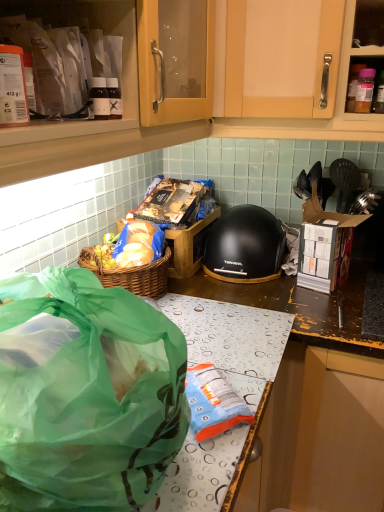
Identify the location of matte plastic container at upper left. The height and width of the screenshot is (512, 384). (123, 49).

I want to click on matte plastic container at upper left, so click(123, 49).

Locate an element on the screen. The image size is (384, 512). helmet located on the right of matte plastic container at upper left is located at coordinates (245, 246).

From a real-world perspective, is matte plastic container at upper left above or below black matte helmet at center?

In terms of real-world spatial position, matte plastic container at upper left is above black matte helmet at center.

Is black matte helmet at center surrounded by matte plastic container at upper left?

No, black matte helmet at center is not surrounded by matte plastic container at upper left.

Which of these two, matte plastic container at upper left or black matte helmet at center, is smaller?

With smaller size is matte plastic container at upper left.

Is black matte helmet at center inside the boundaries of green translucent bag at lower left, or outside?

black matte helmet at center cannot be found inside green translucent bag at lower left.

From the image's perspective, is black matte helmet at center on top of green translucent bag at lower left?

Correct, black matte helmet at center appears higher than green translucent bag at lower left in the image.

Looking at this image, is black matte helmet at center touching green translucent bag at lower left?

No, black matte helmet at center is not in contact with green translucent bag at lower left.

Is matte plastic container at upper left at the back of green translucent bag at lower left?

green translucent bag at lower left is not turned away from matte plastic container at upper left.

This screenshot has height=512, width=384. Find the location of `cabinetry to the left of green translucent bag at lower left`. cabinetry to the left of green translucent bag at lower left is located at coordinates (123, 49).

Considering the sizes of objects green translucent bag at lower left and matte plastic container at upper left in the image provided, who is taller, green translucent bag at lower left or matte plastic container at upper left?

green translucent bag at lower left.

From the image's perspective, is matte plastic container at upper left on green translucent bag at lower left?

Yes.

Is matte plastic container at upper left outside of green translucent bag at lower left?

Yes, matte plastic container at upper left is not within green translucent bag at lower left.

Can you confirm if matte plastic container at upper left is wider than green translucent bag at lower left?

In fact, matte plastic container at upper left might be narrower than green translucent bag at lower left.

Is matte plastic container at upper left oriented away from green translucent bag at lower left?

No.

Considering the sizes of objects green translucent bag at lower left and black matte helmet at center in the image provided, who is taller, green translucent bag at lower left or black matte helmet at center?

Standing taller between the two is green translucent bag at lower left.

Measure the distance between green translucent bag at lower left and black matte helmet at center.

green translucent bag at lower left is 79.77 centimeters from black matte helmet at center.

Is green translucent bag at lower left spatially inside black matte helmet at center, or outside of it?

green translucent bag at lower left lies outside black matte helmet at center.

Does point (96, 280) come in front of point (247, 248)?

That is True.

Would you say black matte helmet at center contains matte plastic container at upper left?

No, matte plastic container at upper left is not inside black matte helmet at center.

Looking at the image, does black matte helmet at center seem bigger or smaller compared to matte plastic container at upper left?

black matte helmet at center is bigger than matte plastic container at upper left.

The height and width of the screenshot is (512, 384). In the image, there is a black matte helmet at center. In order to click on cabinetry above it (from the image's perspective) in this screenshot , I will do `click(123, 49)`.

Is the surface of black matte helmet at center in direct contact with matte plastic container at upper left?

No, black matte helmet at center is not making contact with matte plastic container at upper left.

The width and height of the screenshot is (384, 512). Identify the location of helmet behind the matte plastic container at upper left. (245, 246).

This screenshot has height=512, width=384. In the image, there is a green translucent bag at lower left. In order to click on helmet below it (from a real-world perspective) in this screenshot , I will do (x=245, y=246).

When comparing their distances from black matte helmet at center, does matte plastic container at upper left or green translucent bag at lower left seem closer?

Among the two, matte plastic container at upper left is located nearer to black matte helmet at center.

Estimate the real-world distances between objects in this image. Which object is further from green translucent bag at lower left, matte plastic container at upper left or black matte helmet at center?

Based on the image, black matte helmet at center appears to be further to green translucent bag at lower left.

Estimate the real-world distances between objects in this image. Which object is closer to green translucent bag at lower left, black matte helmet at center or matte plastic container at upper left?

matte plastic container at upper left.

Based on their spatial positions, is black matte helmet at center or green translucent bag at lower left closer to matte plastic container at upper left?

Based on the image, green translucent bag at lower left appears to be nearer to matte plastic container at upper left.

Estimate the real-world distances between objects in this image. Which object is closer to matte plastic container at upper left, green translucent bag at lower left or black matte helmet at center?

green translucent bag at lower left.

Looking at the image, which one is located further to black matte helmet at center, green translucent bag at lower left or matte plastic container at upper left?

green translucent bag at lower left.

Image resolution: width=384 pixels, height=512 pixels. I want to click on cabinetry between green translucent bag at lower left and black matte helmet at center from front to back, so click(x=123, y=49).